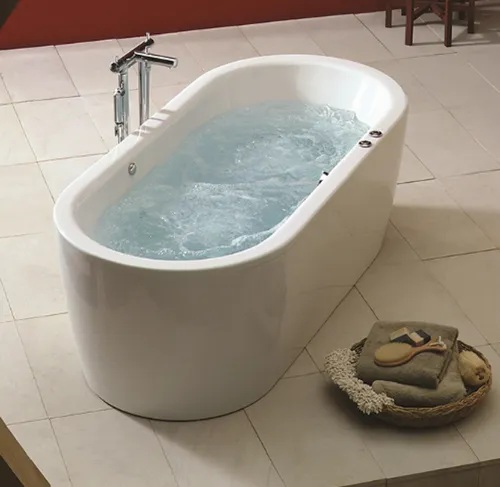
Find the location of `bowl`. bowl is located at coordinates (455, 405).